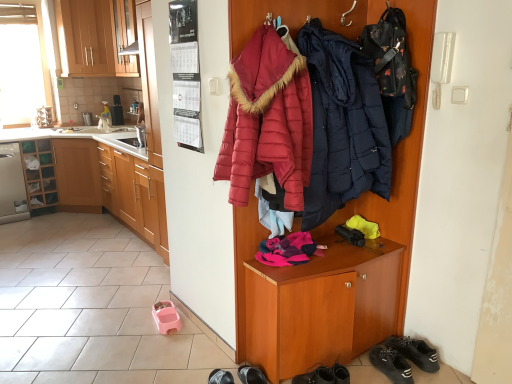
The height and width of the screenshot is (384, 512). I want to click on free space behind black leather shoe at lower center, the second footwear positioned from the right, so click(x=243, y=368).